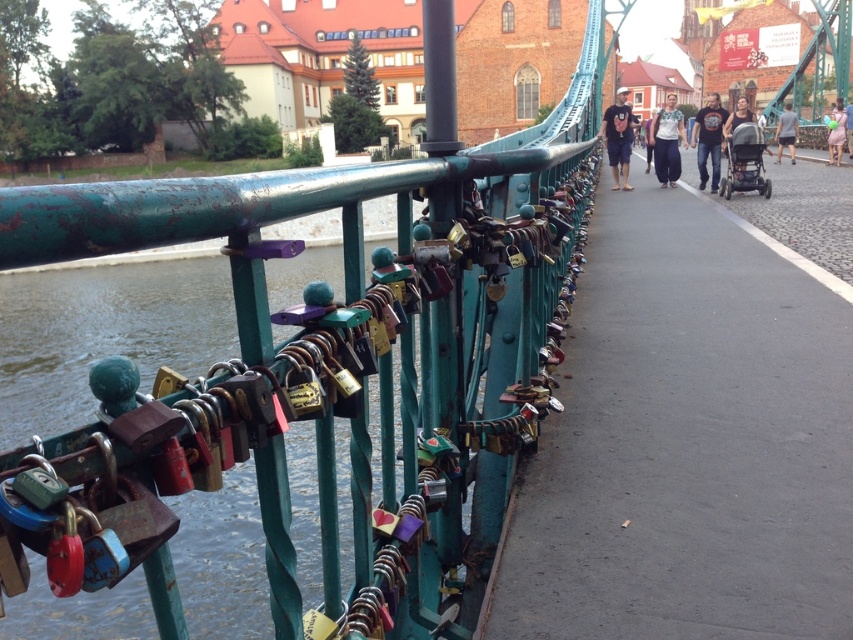
You are a photographer standing on the pedestrian bridge and see the white cotton shirt at center and the light pink fabric dress at right. Which clothing item is positioned higher from the ground?

The white cotton shirt at center is located above the light pink fabric dress at right, so it is positioned higher from the ground.

You are standing on the pedestrian bridge and see the matte black backpack at center. If you want to move to the point at coordinate 0.214, 0.726, which object should you walk towards?

You should walk towards the matte black backpack at center because its 2D location is at point (618, 136).

You are standing on the pedestrian bridge and notice a white cotton shirt at center. Where exactly is the white cotton shirt positioned relative to the bridge railing?

The white cotton shirt at center is located at point coordinates of 0.222 on the x axis and 0.783 on the y axis, so it is positioned closer to the left side of the bridge and slightly below the midpoint along the length of the bridge.